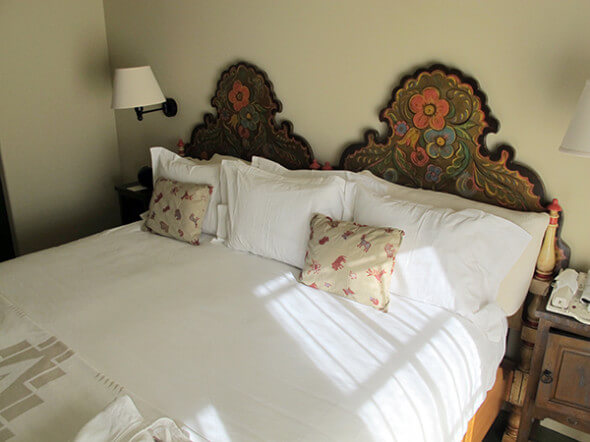
At what (x,y) coordinates should I click in order to perform the action: click on headboard. Please return your answer as a coordinate pair (x, y). This screenshot has width=590, height=442. Looking at the image, I should click on (258, 94), (455, 110).